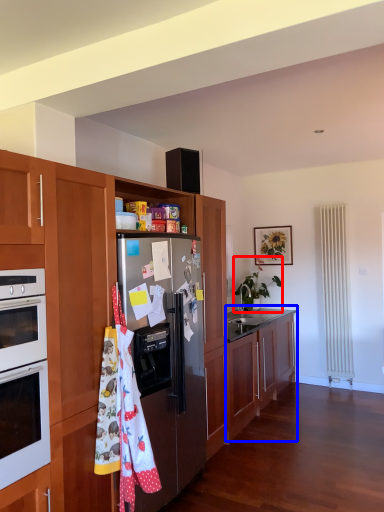
Question: Among these objects, which one is nearest to the camera, houseplant (highlighted by a red box) or cabinetry (highlighted by a blue box)?

Choices:
 (A) houseplant
 (B) cabinetry

Answer: (B)